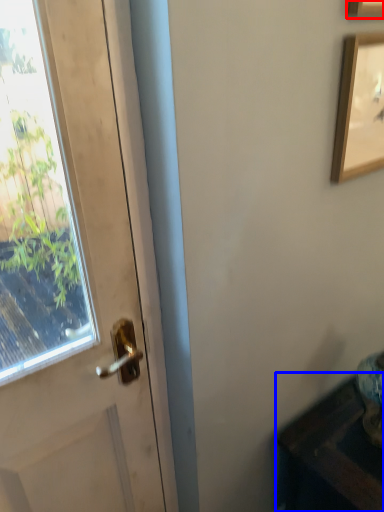
Question: Which of the following is the closest to the observer, picture frame (highlighted by a red box) or furniture (highlighted by a blue box)?

Choices:
 (A) picture frame
 (B) furniture

Answer: (A)